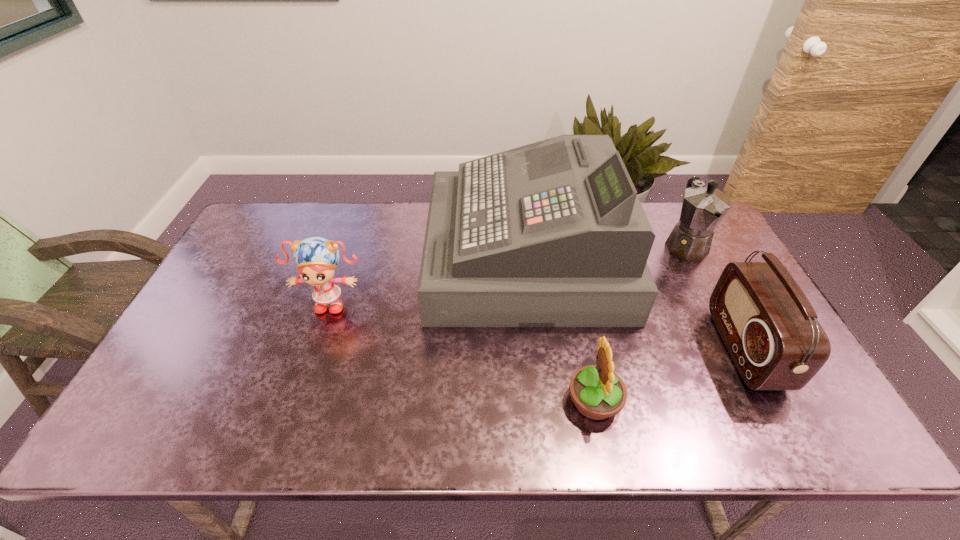
Image resolution: width=960 pixels, height=540 pixels. Identify the location of the tallest object. (551, 234).

Locate an element on the screen. The height and width of the screenshot is (540, 960). coffeepot is located at coordinates (703, 208).

The width and height of the screenshot is (960, 540). Identify the location of radio receiver. (769, 327).

Identify the location of doll. The height and width of the screenshot is (540, 960). (316, 258).

Where is `sunflower`? sunflower is located at coordinates (598, 393).

Locate an element on the screen. Image resolution: width=960 pixels, height=540 pixels. free space located on the front-facing side of the tallest object is located at coordinates (367, 257).

This screenshot has width=960, height=540. I want to click on free point located 0.150m on the front-facing side of the tallest object, so click(x=383, y=257).

Identify the location of blank space located on the front-facing side of the tallest object. The height and width of the screenshot is (540, 960). (376, 257).

Locate an element on the screen. vacant region located 0.090m on the pouring side of the coffeepot is located at coordinates (708, 288).

What are the coordinates of `free space located 0.170m on the front panel of the radio receiver` in the screenshot? It's located at (660, 348).